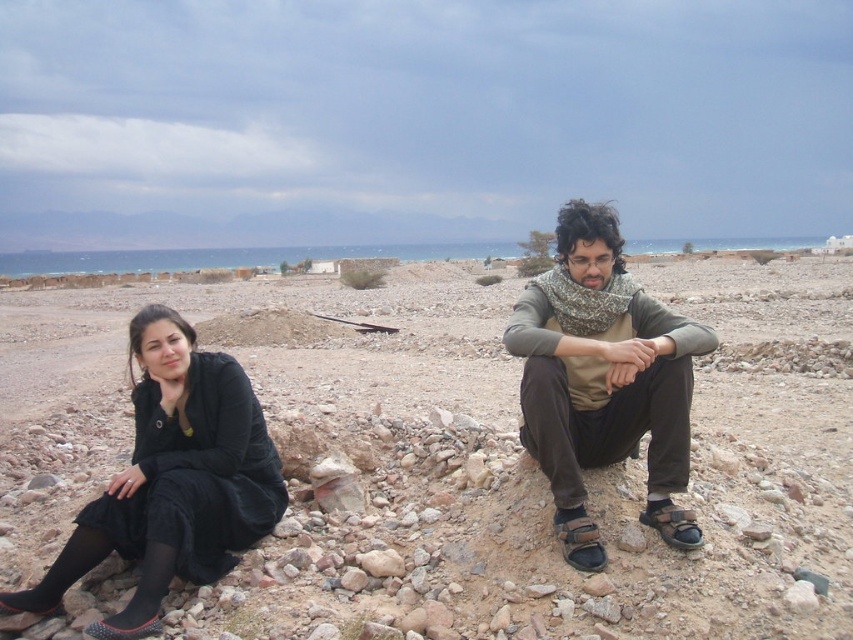
Is point (764, 452) less distant than point (236, 493)?

No.

Is smooth sand beach at center shorter than black matte dress at lower left?

Incorrect, smooth sand beach at center's height does not fall short of black matte dress at lower left's.

Does point (366, 424) come behind point (173, 326)?

Yes, point (366, 424) is behind point (173, 326).

Where is `smooth sand beach at center`? smooth sand beach at center is located at coordinates (463, 460).

Does matte brown scarf at center have a larger size compared to black matte dress at lower left?

Yes, matte brown scarf at center is bigger than black matte dress at lower left.

Which of these two, matte brown scarf at center or black matte dress at lower left, stands shorter?

Standing shorter between the two is black matte dress at lower left.

Is point (566, 282) more distant than point (178, 401)?

That is True.

At what (x,y) coordinates should I click in order to perform the action: click on matte brown scarf at center. Please return your answer as a coordinate pair (x, y). Looking at the image, I should click on (602, 380).

Is smooth sand beach at center below matte brown scarf at center?

Incorrect, smooth sand beach at center is not positioned below matte brown scarf at center.

Between smooth sand beach at center and matte brown scarf at center, which one is positioned higher?

smooth sand beach at center is above.

Between point (614, 557) and point (585, 225), which one is positioned in front?

Point (614, 557) is more forward.

Locate an element on the screen. smooth sand beach at center is located at coordinates (463, 460).